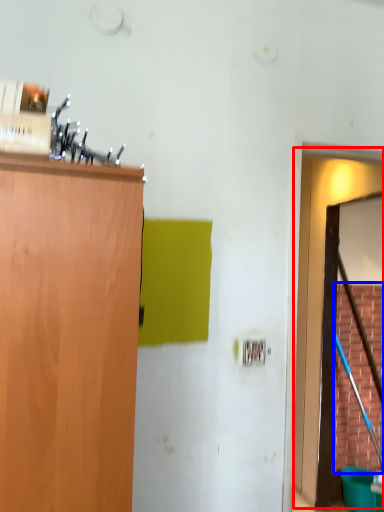
Question: Which object is closer to the camera taking this photo, door (highlighted by a red box) or plywood (highlighted by a blue box)?

Choices:
 (A) door
 (B) plywood

Answer: (A)